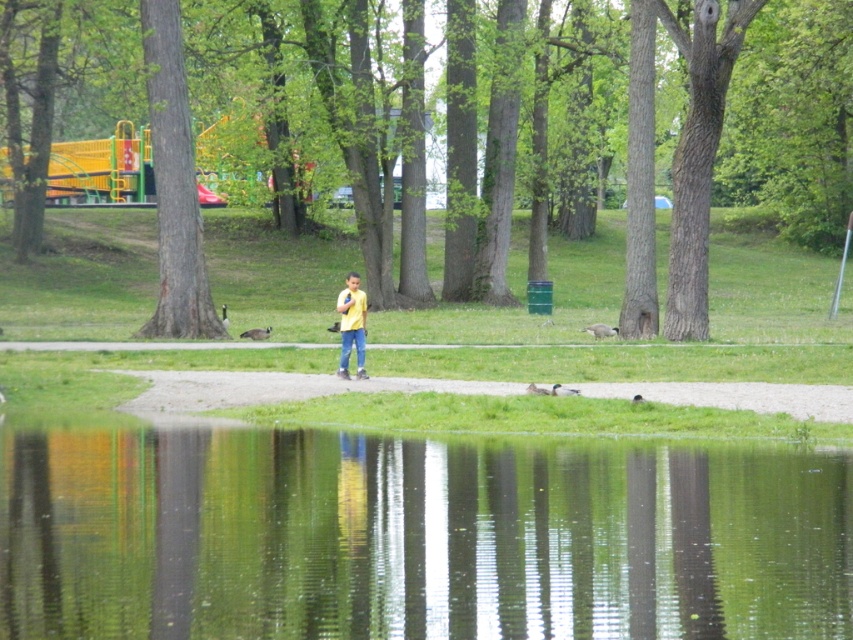
You are a photographer trying to capture a shot of the green reflective water at center and the brown rough tree at left. Based on their positions, which object would appear larger in your photo?

The green reflective water at center appears larger in the photo because it is closer to the viewer than the brown rough tree at left.